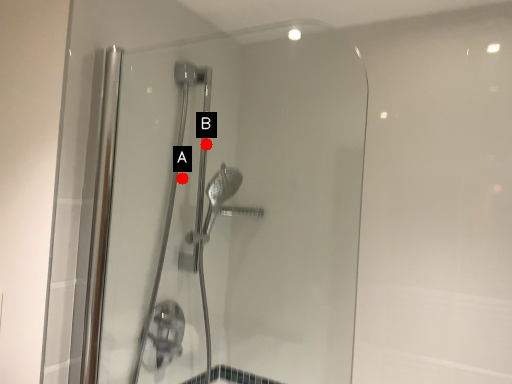
Question: Two points are circled on the image, labeled by A and B beside each circle. Which point is further to the camera?

Choices:
 (A) A is further
 (B) B is further

Answer: (B)